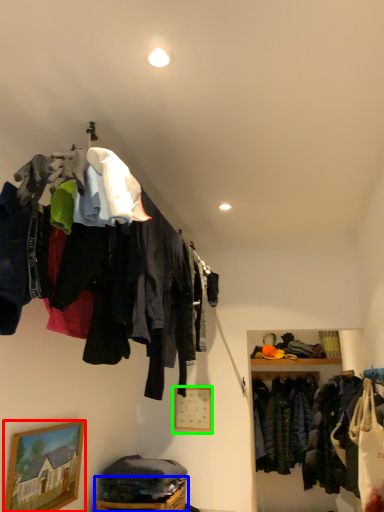
Question: Based on their relative distances, which object is nearer to picture frame (highlighted by a red box)? Choose from basket (highlighted by a blue box) and picture frame (highlighted by a green box).

Choices:
 (A) basket
 (B) picture frame

Answer: (A)